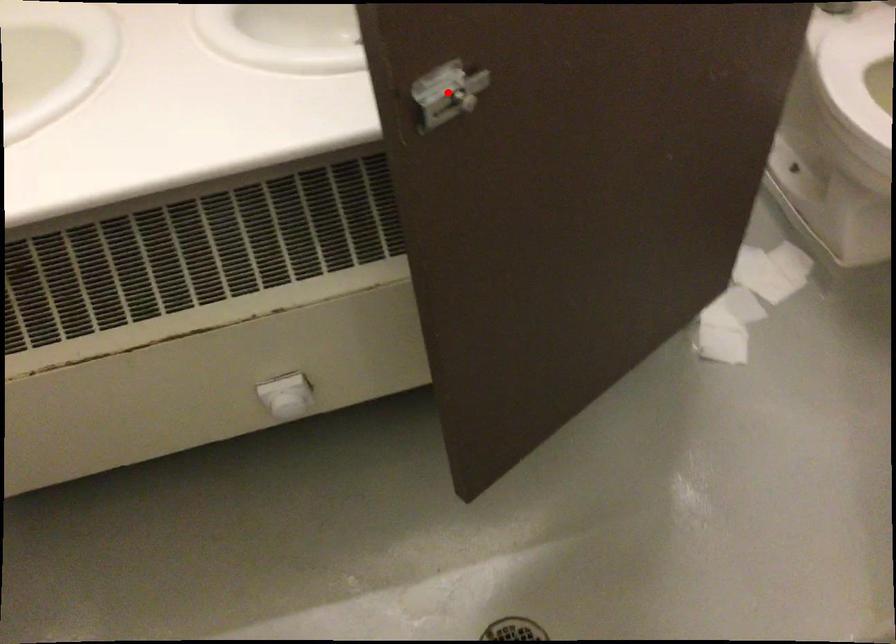
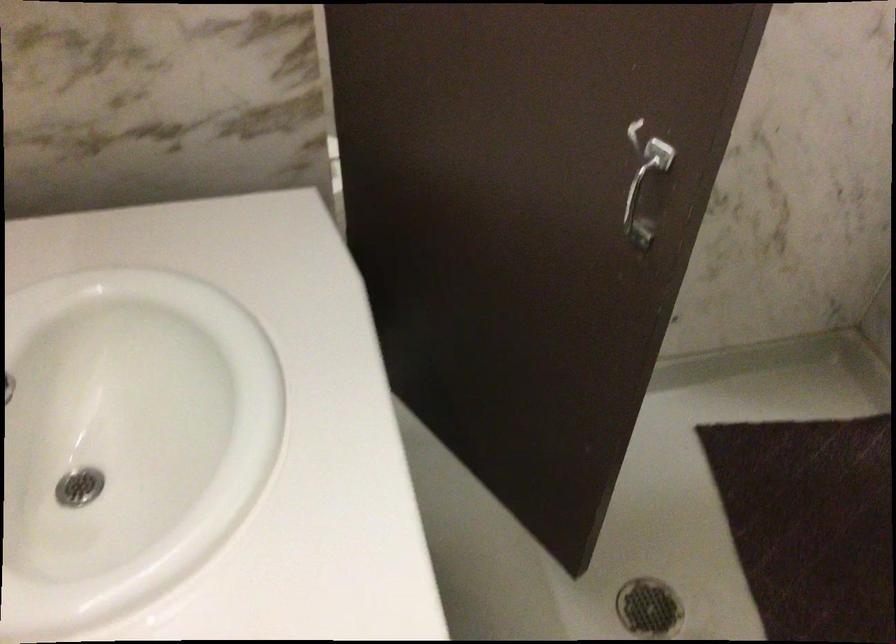
Question: I am providing you with two images of the same scene from different viewpoints. A red point is marked on the first image. At the location where the point appears in image 1, is it still visible in image 2?

Choices:
 (A) Yes
 (B) No

Answer: (B)